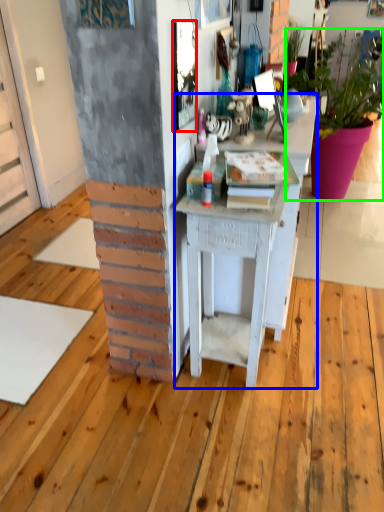
Question: Based on their relative distances, which object is farther from picture frame (highlighted by a red box)? Choose from desk (highlighted by a blue box) and houseplant (highlighted by a green box).

Choices:
 (A) desk
 (B) houseplant

Answer: (B)